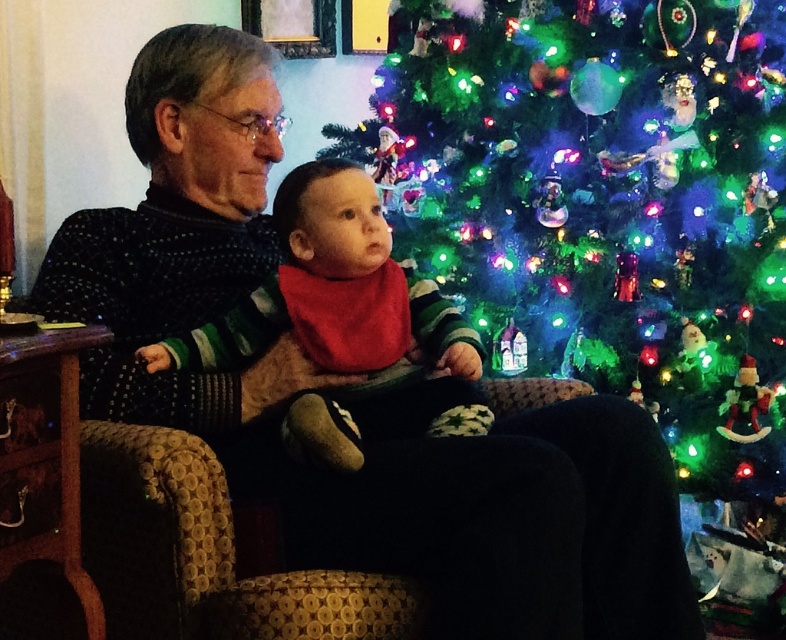
Does iridescent plastic ornaments at center have a lesser width compared to red cotton bib at center?

In fact, iridescent plastic ornaments at center might be wider than red cotton bib at center.

Is point (399, 100) positioned behind point (360, 196)?

That is True.

At what (x,y) coordinates should I click in order to perform the action: click on iridescent plastic ornaments at center. Please return your answer as a coordinate pair (x, y). The width and height of the screenshot is (786, 640). Looking at the image, I should click on (x=608, y=205).

At what (x,y) coordinates should I click in order to perform the action: click on iridescent plastic ornaments at center. Please return your answer as a coordinate pair (x, y). Looking at the image, I should click on (608, 205).